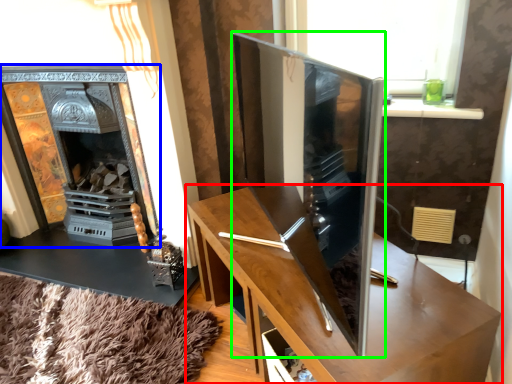
Question: Which object is positioned farthest from table (highlighted by a red box)? Select from fireplace (highlighted by a blue box) and tv cabinet (highlighted by a green box).

Choices:
 (A) fireplace
 (B) tv cabinet

Answer: (A)